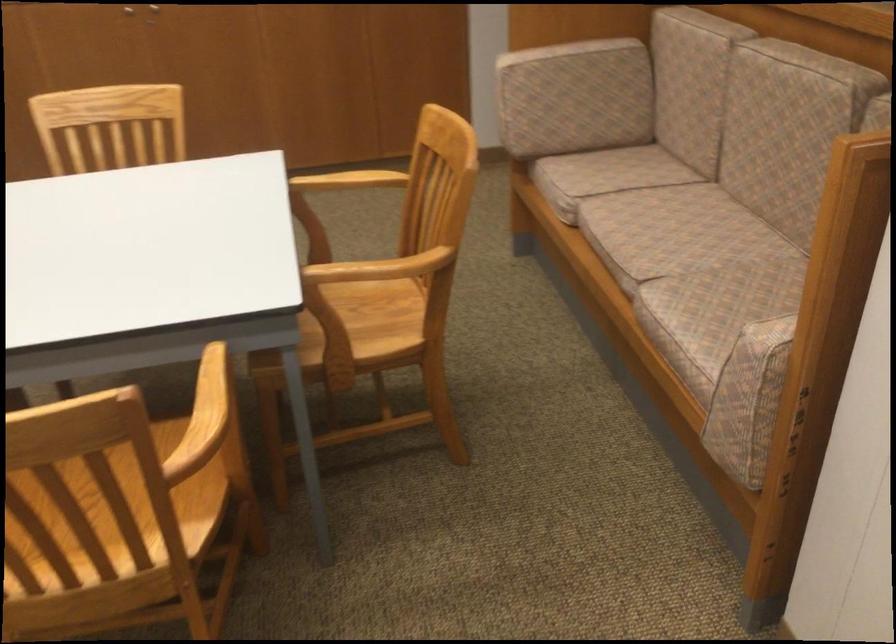
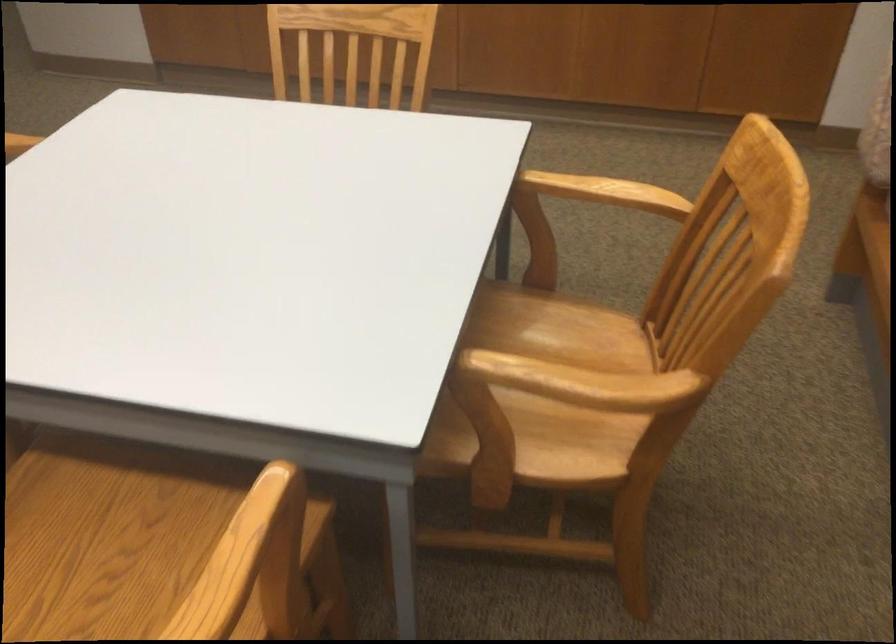
Question: What movement of the cameraman would produce the second image?

Choices:
 (A) Left
 (B) Right
 (C) Forward
 (D) Backward

Answer: (C)